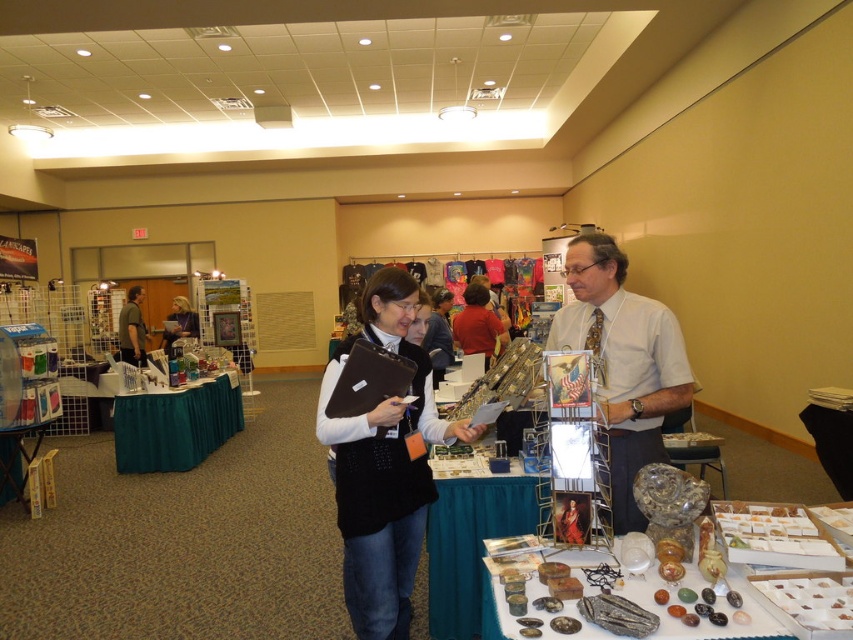
Question: Considering the relative positions of matte black sweater at center and green fabric tablecloth at center in the image provided, where is matte black sweater at center located with respect to green fabric tablecloth at center?

Choices:
 (A) left
 (B) right

Answer: (B)

Question: Where is black felt vest at center located in relation to light gray shirt at center in the image?

Choices:
 (A) below
 (B) above

Answer: (A)

Question: Based on their relative distances, which object is nearer to the matte black folder at center?

Choices:
 (A) black fabric vest at center
 (B) light gray shirt at center

Answer: (B)

Question: Which point is closer to the camera?

Choices:
 (A) black felt vest at center
 (B) matte black folder at center
 (C) green fabric tablecloth at center
 (D) matte black sweater at center

Answer: (A)

Question: Which point is closer to the camera?

Choices:
 (A) (634, 365)
 (B) (416, 378)

Answer: (A)

Question: Can you confirm if black fabric vest at center is positioned below matte black folder at center?

Choices:
 (A) yes
 (B) no

Answer: (A)